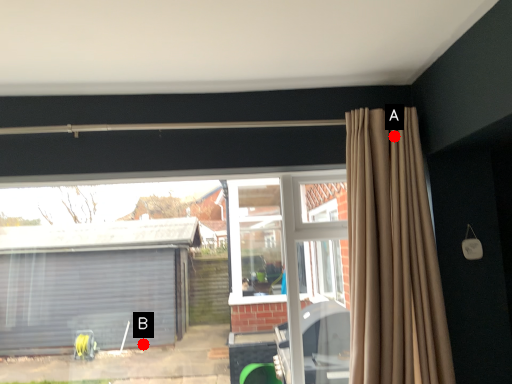
Question: Two points are circled on the image, labeled by A and B beside each circle. Which point appears closest to the camera in this image?

Choices:
 (A) A is closer
 (B) B is closer

Answer: (A)